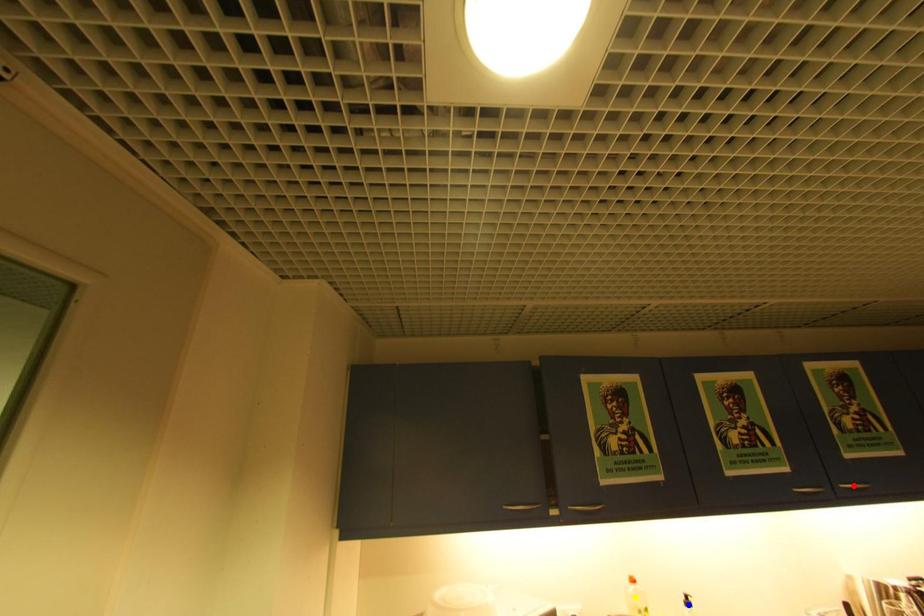
Order these from nearest to farthest:
- blue point
- yellow point
- red point

red point
yellow point
blue point